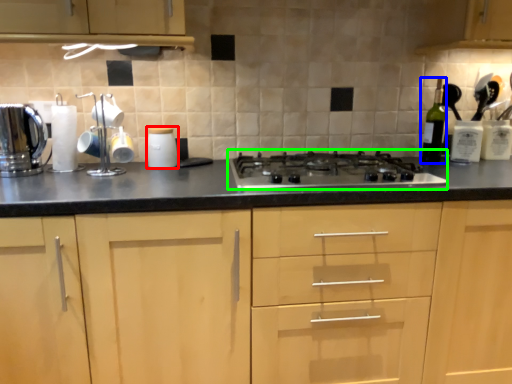
Question: Which object is positioned farthest from kitchen appliance (highlighted by a red box)? Select from bottle (highlighted by a blue box) and gas stove (highlighted by a green box).

Choices:
 (A) bottle
 (B) gas stove

Answer: (A)